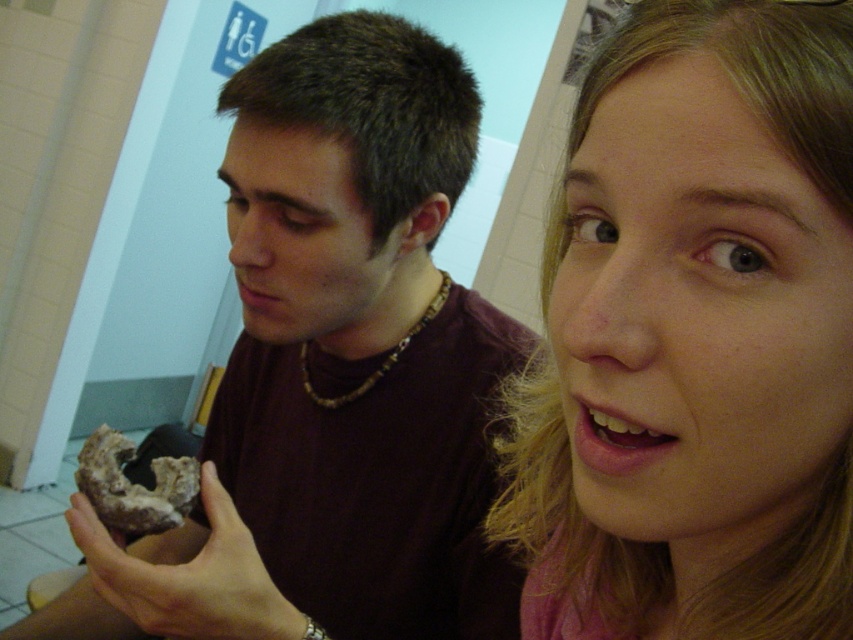
You are a food critic visiting a bakery and see the matte brown donut at center and the brown textured mushroom at lower left. Which one is bigger?

The matte brown donut at center is larger in size than the brown textured mushroom at lower left.

You are a baker who needs to place both the matte brown donut at center and the chocolate glazed donut at lower left on a display shelf. The shelf has a height limit of 10 cm. Can you fit both donuts vertically without exceeding the height limit?

The matte brown donut at center is much taller than the chocolate glazed donut at lower left. Since the shelf has a height limit of 10 cm, the taller matte brown donut at center might exceed the limit, so you cannot fit both vertically without exceeding the height limit.